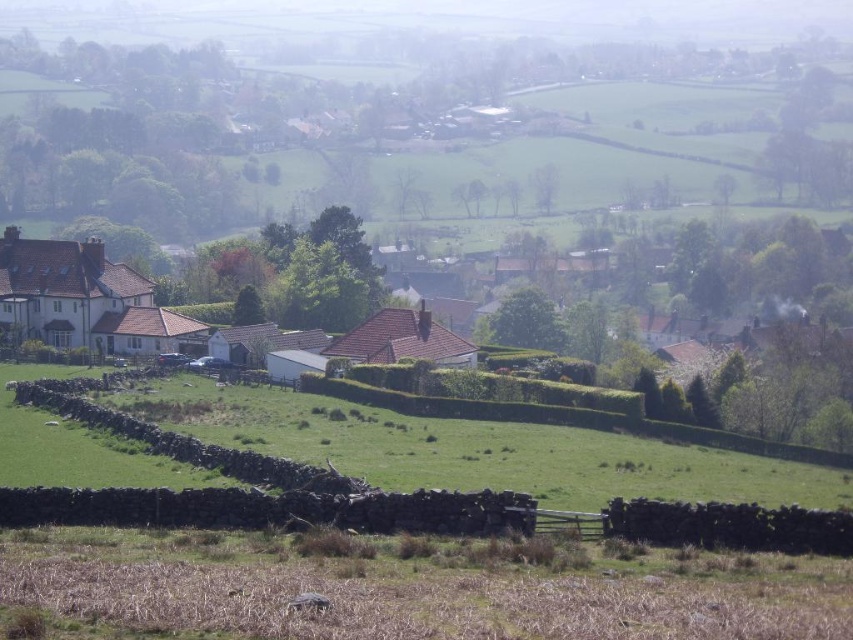
Question: Can you confirm if green grassy field at lower center is wider than white matte house at center?

Choices:
 (A) no
 (B) yes

Answer: (A)

Question: Does green grassy field at lower center appear under white matte house at center?

Choices:
 (A) yes
 (B) no

Answer: (A)

Question: Among these objects, which one is nearest to the camera?

Choices:
 (A) white matte house at center
 (B) green grassy field at lower center

Answer: (B)

Question: Is green grassy field at lower center below white matte house at center?

Choices:
 (A) no
 (B) yes

Answer: (B)